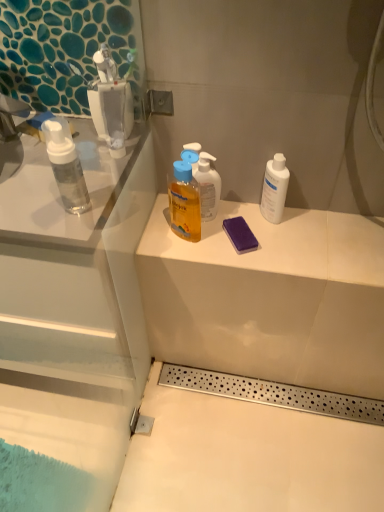
The image size is (384, 512). Find the location of `white matte bottle at right`. white matte bottle at right is located at coordinates (274, 189).

Is matte white counter at center positioned behind purple sponge at center?

No, it is in front of purple sponge at center.

Which is farther, (223, 202) or (229, 232)?

The point (223, 202) is farther.

Is matte white counter at center inside or outside of purple sponge at center?

matte white counter at center exists outside the volume of purple sponge at center.

From a real-world perspective, between matte white counter at center and purple sponge at center, who is vertically lower?

matte white counter at center, from a real-world perspective.

This screenshot has height=512, width=384. Identify the location of counter top behind the white matte bottle at right. (280, 244).

Which of these two, matte white counter at center or white matte bottle at right, is wider?

With larger width is matte white counter at center.

From a real-world perspective, between matte white counter at center and white matte bottle at right, who is vertically higher?

From a 3D spatial view, white matte bottle at right is above.

From the image's perspective, does purple sponge at center appear lower than white matte bottle at right?

Yes, from the image's perspective, purple sponge at center is below white matte bottle at right.

Is point (239, 247) less distant than point (283, 207)?

Yes, it is.

Between purple sponge at center and white matte bottle at right, which one has smaller width?

With smaller width is white matte bottle at right.

Identify the location of soap behind the white matte bottle at right. (240, 234).

Considering the relative sizes of white matte bottle at right and purple sponge at center in the image provided, is white matte bottle at right taller than purple sponge at center?

Yes.

Which of these two, white matte bottle at right or purple sponge at center, is wider?

purple sponge at center.

Which point is more forward, (279, 166) or (254, 249)?

Positioned in front is point (279, 166).

Does point (168, 183) come in front of point (250, 240)?

No, it is behind (250, 240).

Based on their positions, is translucent yellow liquid at upper center located to the left or right of purple sponge at center?

From the image, it's evident that translucent yellow liquid at upper center is to the left of purple sponge at center.

Relative to purple sponge at center, is translucent yellow liquid at upper center in front or behind?

In the image, translucent yellow liquid at upper center appears in front of purple sponge at center.

Is translucent yellow liquid at upper center spatially inside purple sponge at center, or outside of it?

translucent yellow liquid at upper center is outside purple sponge at center.

Is point (246, 238) positioned in front of point (179, 204)?

No, (246, 238) is behind (179, 204).

Does purple sponge at center turn towards translucent yellow liquid at upper center?

No, purple sponge at center is not aimed at translucent yellow liquid at upper center.

From the image's perspective, between purple sponge at center and translucent yellow liquid at upper center, who is located below?

purple sponge at center, from the image's perspective.

Is matte white counter at center at the left side of translucent yellow liquid at upper center?

No.

How much distance is there between matte white counter at center and translucent yellow liquid at upper center?

A distance of 7.16 inches exists between matte white counter at center and translucent yellow liquid at upper center.

From a real-world perspective, which object rests below the other?

matte white counter at center is physically lower.

The height and width of the screenshot is (512, 384). What are the coordinates of `counter top below the purple sponge at center (from the image's perspective)` in the screenshot? It's located at (280, 244).

I want to click on mouthwash in front of the matte white counter at center, so click(x=274, y=189).

When comparing their distances from matte white counter at center, does translucent yellow liquid at upper center or purple sponge at center seem closer?

Based on the image, purple sponge at center appears to be nearer to matte white counter at center.

Estimate the real-world distances between objects in this image. Which object is further from white matte bottle at right, translucent yellow liquid at upper center or purple sponge at center?

translucent yellow liquid at upper center lies further to white matte bottle at right than the other object.

Considering their positions, is matte white counter at center positioned closer to purple sponge at center than white matte bottle at right?

white matte bottle at right lies closer to purple sponge at center than the other object.

Looking at the image, which one is located further to matte white counter at center, white matte bottle at right or purple sponge at center?

white matte bottle at right is positioned further to the anchor matte white counter at center.

Considering their positions, is white matte bottle at right positioned closer to translucent yellow liquid at upper center than matte white counter at center?

matte white counter at center.

From the picture: Estimate the real-world distances between objects in this image. Which object is closer to translucent yellow liquid at upper center, matte white counter at center or white matte bottle at right?

matte white counter at center is closer to translucent yellow liquid at upper center.

Considering their positions, is matte white counter at center positioned further to white matte bottle at right than purple sponge at center?

matte white counter at center is positioned further to the anchor white matte bottle at right.

Considering their positions, is matte white counter at center positioned closer to translucent yellow liquid at upper center than purple sponge at center?

The object closer to translucent yellow liquid at upper center is purple sponge at center.

Locate an element on the screen. soap situated between translucent yellow liquid at upper center and matte white counter at center from left to right is located at coordinates (240, 234).

This screenshot has height=512, width=384. I want to click on soap situated between translucent yellow liquid at upper center and white matte bottle at right from left to right, so click(240, 234).

You are a GUI agent. You are given a task and a screenshot of the screen. Output one action in this format:
    pyautogui.click(x=<x>, y=<y>)
    Task: Click on the soap that lies between white matte bottle at right and matte white counter at center from top to bottom
    The image size is (384, 512).
    Given the screenshot: What is the action you would take?
    pyautogui.click(x=240, y=234)

The height and width of the screenshot is (512, 384). Identify the location of counter top between translucent yellow liquid at upper center and white matte bottle at right. (280, 244).